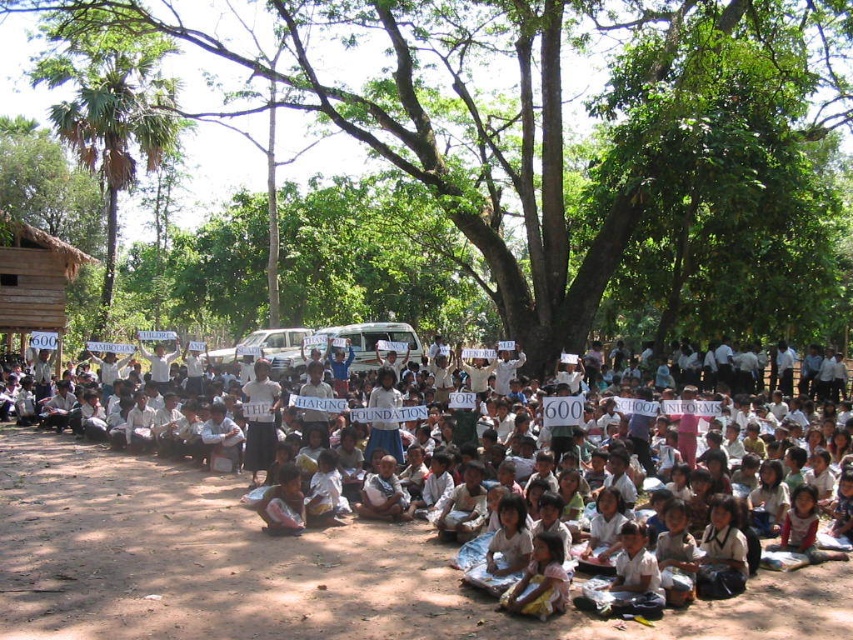
What is located at the coordinates point (x=566, y=140) in the image?

The green leafy tree at center is located at point (x=566, y=140).

You are a photographer taking a picture of the children. You notice two points in the scene, one at coordinate point (755, 211) and another at point (119, 81). If you want to focus on the point that is closer to you, which coordinate should you adjust your camera to focus on?

You should focus on point (755, 211) because it is closer to the camera than point (119, 81).